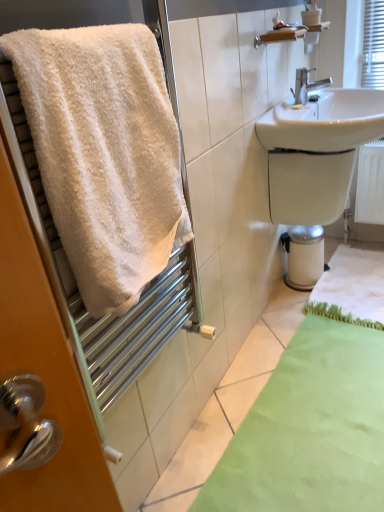
Where is `white glossy sink at upper right`? This screenshot has height=512, width=384. white glossy sink at upper right is located at coordinates pos(316,150).

Measure the distance between point (328,288) and camera.

A distance of 6.55 feet exists between point (328,288) and camera.

Find the location of a particular element. The height and width of the screenshot is (512, 384). white glossy bidet at lower right is located at coordinates (304, 256).

Find the location of a particular element. The image size is (384, 512). green fabric bath mat at lower center, placed as the 1th bath mat when sorted from front to back is located at coordinates (310, 429).

This screenshot has height=512, width=384. What do you see at coordinates (104, 153) in the screenshot?
I see `white fluffy towel at left` at bounding box center [104, 153].

The image size is (384, 512). I want to click on white glossy sink at upper right, so click(316, 150).

Which object is thinner, green fuzzy bath mat at lower right, which ranks as the 2th bath mat in front-to-back order, or white fluffy towel at left?

white fluffy towel at left is thinner.

Is point (370, 295) positioned before point (110, 170)?

No, (370, 295) is behind (110, 170).

Would you say white fluffy towel at left is part of green fuzzy bath mat at lower right, which ranks as the 2th bath mat in front-to-back order,'s contents?

No.

Between green fuzzy bath mat at lower right, which ranks as the 2th bath mat in front-to-back order, and white fluffy towel at left, which one has less height?

Standing shorter between the two is green fuzzy bath mat at lower right, which ranks as the 2th bath mat in front-to-back order.

Does silver metallic faucet at upper right turn towards green fuzzy bath mat at lower right, the 1th bath mat when ordered from back to front?

No, silver metallic faucet at upper right is not oriented towards green fuzzy bath mat at lower right, the 1th bath mat when ordered from back to front.

At what (x,y) coordinates should I click in order to perform the action: click on the 2nd bath mat counting from the right side of the silver metallic faucet at upper right. Please return your answer as a coordinate pair (x, y). The image size is (384, 512). Looking at the image, I should click on (351, 288).

From the image's perspective, does silver metallic faucet at upper right appear lower than green fuzzy bath mat at lower right, which ranks as the 2th bath mat in front-to-back order?

Incorrect, from the image's perspective, silver metallic faucet at upper right is higher than green fuzzy bath mat at lower right, which ranks as the 2th bath mat in front-to-back order.

From the picture: Which point is more distant from viewer, (300, 91) or (288, 257)?

The point (288, 257) is more distant.

In terms of size, does silver metallic faucet at upper right appear bigger or smaller than white glossy bidet at lower right?

silver metallic faucet at upper right is smaller than white glossy bidet at lower right.

Does silver metallic faucet at upper right turn towards white glossy bidet at lower right?

No, silver metallic faucet at upper right is not oriented towards white glossy bidet at lower right.

Which is more to the right, silver metallic faucet at upper right or green fabric bath mat at lower center, arranged as the 2th bath mat when viewed from the back?

green fabric bath mat at lower center, arranged as the 2th bath mat when viewed from the back.

Is silver metallic faucet at upper right directly adjacent to green fabric bath mat at lower center, placed as the 1th bath mat when sorted from front to back?

They are not placed beside each other.

Which object is more forward, silver metallic faucet at upper right or green fabric bath mat at lower center, arranged as the 2th bath mat when viewed from the back?

green fabric bath mat at lower center, arranged as the 2th bath mat when viewed from the back, is more forward.

Is point (299, 84) positioned after point (270, 415)?

Yes, point (299, 84) is behind point (270, 415).

From the image's perspective, is green fuzzy bath mat at lower right, which ranks as the 2th bath mat in front-to-back order, located above or below white glossy bidet at lower right?

Clearly, from the image's perspective, green fuzzy bath mat at lower right, which ranks as the 2th bath mat in front-to-back order, is below white glossy bidet at lower right.

Which is behind, green fuzzy bath mat at lower right, the 1th bath mat when ordered from back to front, or white glossy bidet at lower right?

Positioned behind is white glossy bidet at lower right.

Does green fuzzy bath mat at lower right, which ranks as the 2th bath mat in front-to-back order, appear on the left side of white glossy bidet at lower right?

No, green fuzzy bath mat at lower right, which ranks as the 2th bath mat in front-to-back order, is not to the left of white glossy bidet at lower right.

Considering the sizes of objects green fuzzy bath mat at lower right, the 1th bath mat when ordered from back to front, and white glossy bidet at lower right in the image provided, who is wider, green fuzzy bath mat at lower right, the 1th bath mat when ordered from back to front, or white glossy bidet at lower right?

With larger width is green fuzzy bath mat at lower right, the 1th bath mat when ordered from back to front.

From a real-world perspective, who is located lower, green fuzzy bath mat at lower right, which ranks as the 2th bath mat in front-to-back order, or green fabric bath mat at lower center, arranged as the 2th bath mat when viewed from the back?

green fabric bath mat at lower center, arranged as the 2th bath mat when viewed from the back.

Considering the relative positions of green fuzzy bath mat at lower right, which ranks as the 2th bath mat in front-to-back order, and green fabric bath mat at lower center, arranged as the 2th bath mat when viewed from the back, in the image provided, is green fuzzy bath mat at lower right, which ranks as the 2th bath mat in front-to-back order, to the right of green fabric bath mat at lower center, arranged as the 2th bath mat when viewed from the back, from the viewer's perspective?

Yes, green fuzzy bath mat at lower right, which ranks as the 2th bath mat in front-to-back order, is to the right of green fabric bath mat at lower center, arranged as the 2th bath mat when viewed from the back.

Does green fuzzy bath mat at lower right, which ranks as the 2th bath mat in front-to-back order, have a smaller size compared to green fabric bath mat at lower center, arranged as the 2th bath mat when viewed from the back?

Correct, green fuzzy bath mat at lower right, which ranks as the 2th bath mat in front-to-back order, occupies less space than green fabric bath mat at lower center, arranged as the 2th bath mat when viewed from the back.

Is green fabric bath mat at lower center, arranged as the 2th bath mat when viewed from the back, a part of green fuzzy bath mat at lower right, which ranks as the 2th bath mat in front-to-back order?

No.

From the image's perspective, is white fluffy towel at left above or below silver metallic faucet at upper right?

Based on their image positions, white fluffy towel at left is located beneath silver metallic faucet at upper right.

How different are the orientations of white fluffy towel at left and silver metallic faucet at upper right in degrees?

The angle between the facing direction of white fluffy towel at left and the facing direction of silver metallic faucet at upper right is 1.34 degrees.

Which object is positioned more to the left, white fluffy towel at left or silver metallic faucet at upper right?

Positioned to the left is white fluffy towel at left.

Are white fluffy towel at left and silver metallic faucet at upper right located far from each other?

Yes, white fluffy towel at left and silver metallic faucet at upper right are quite far apart.

Find the location of a particular element. Image resolution: width=384 pixels, height=512 pixels. towel in front of the green fuzzy bath mat at lower right, which ranks as the 2th bath mat in front-to-back order is located at coordinates (104, 153).

Identify the location of bath mat behind the silver metallic faucet at upper right. This screenshot has height=512, width=384. [x=351, y=288].

Which object lies nearer to the anchor point green fabric bath mat at lower center, arranged as the 2th bath mat when viewed from the back, white glossy bidet at lower right or white glossy sink at upper right?

Based on the image, white glossy bidet at lower right appears to be nearer to green fabric bath mat at lower center, arranged as the 2th bath mat when viewed from the back.

Based on their spatial positions, is green fuzzy bath mat at lower right, the 1th bath mat when ordered from back to front, or white fluffy towel at left closer to white glossy bidet at lower right?

Among the two, green fuzzy bath mat at lower right, the 1th bath mat when ordered from back to front, is located nearer to white glossy bidet at lower right.

Looking at the image, which one is located further to white glossy bidet at lower right, green fuzzy bath mat at lower right, which ranks as the 2th bath mat in front-to-back order, or white glossy sink at upper right?

Among the two, white glossy sink at upper right is located further to white glossy bidet at lower right.

From the image, which object appears to be nearer to white fluffy towel at left, silver metallic faucet at upper right or green fabric bath mat at lower center, placed as the 1th bath mat when sorted from front to back?

Based on the image, green fabric bath mat at lower center, placed as the 1th bath mat when sorted from front to back, appears to be nearer to white fluffy towel at left.

Looking at the image, which one is located further to green fuzzy bath mat at lower right, the 1th bath mat when ordered from back to front, white glossy bidet at lower right or silver metallic faucet at upper right?

silver metallic faucet at upper right lies further to green fuzzy bath mat at lower right, the 1th bath mat when ordered from back to front, than the other object.

In the scene shown: Looking at the image, which one is located closer to white glossy bidet at lower right, white fluffy towel at left or silver metallic faucet at upper right?

Based on the image, silver metallic faucet at upper right appears to be nearer to white glossy bidet at lower right.

Based on their spatial positions, is green fabric bath mat at lower center, arranged as the 2th bath mat when viewed from the back, or white glossy sink at upper right closer to silver metallic faucet at upper right?

Based on the image, white glossy sink at upper right appears to be nearer to silver metallic faucet at upper right.

Looking at the image, which one is located closer to green fabric bath mat at lower center, placed as the 1th bath mat when sorted from front to back, green fuzzy bath mat at lower right, which ranks as the 2th bath mat in front-to-back order, or white fluffy towel at left?

green fuzzy bath mat at lower right, which ranks as the 2th bath mat in front-to-back order, lies closer to green fabric bath mat at lower center, placed as the 1th bath mat when sorted from front to back, than the other object.

This screenshot has width=384, height=512. I want to click on tap positioned between white fluffy towel at left and green fuzzy bath mat at lower right, the 1th bath mat when ordered from back to front, from near to far, so (x=307, y=85).

Identify the location of sink that lies between silver metallic faucet at upper right and green fuzzy bath mat at lower right, which ranks as the 2th bath mat in front-to-back order, from top to bottom. (316, 150).

The width and height of the screenshot is (384, 512). Find the location of `bath mat located between green fabric bath mat at lower center, arranged as the 2th bath mat when viewed from the back, and white glossy bidet at lower right in the depth direction`. bath mat located between green fabric bath mat at lower center, arranged as the 2th bath mat when viewed from the back, and white glossy bidet at lower right in the depth direction is located at coordinates (351, 288).

The height and width of the screenshot is (512, 384). Find the location of `sink between silver metallic faucet at upper right and white glossy bidet at lower right in the up-down direction`. sink between silver metallic faucet at upper right and white glossy bidet at lower right in the up-down direction is located at coordinates (316, 150).